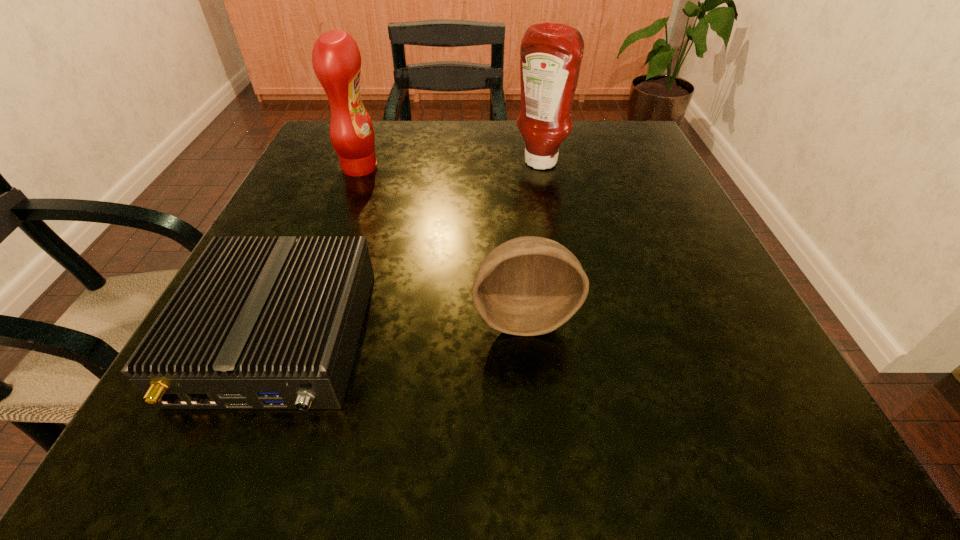
Where is `the right condiment`? The width and height of the screenshot is (960, 540). the right condiment is located at coordinates (551, 54).

Where is `the left condiment`? This screenshot has width=960, height=540. the left condiment is located at coordinates (336, 59).

At what (x,y) coordinates should I click in order to perform the action: click on bowl. Please return your answer as a coordinate pair (x, y). This screenshot has width=960, height=540. Looking at the image, I should click on (528, 286).

This screenshot has width=960, height=540. I want to click on the shortest object, so click(258, 323).

Locate an element on the screen. This screenshot has width=960, height=540. vacant space situated on the left of the right condiment is located at coordinates (414, 164).

Where is `free location located on the label side of the left condiment`? The height and width of the screenshot is (540, 960). free location located on the label side of the left condiment is located at coordinates (519, 167).

At what (x,y) coordinates should I click in order to perform the action: click on blank space located on the back of the bowl. Please return your answer as a coordinate pair (x, y). The width and height of the screenshot is (960, 540). Looking at the image, I should click on (516, 226).

Where is `object that is at the near edge`? This screenshot has height=540, width=960. object that is at the near edge is located at coordinates (258, 323).

Locate an element on the screen. condiment that is at the left edge is located at coordinates (336, 59).

Locate an element on the screen. This screenshot has width=960, height=540. router present at the left edge is located at coordinates (258, 323).